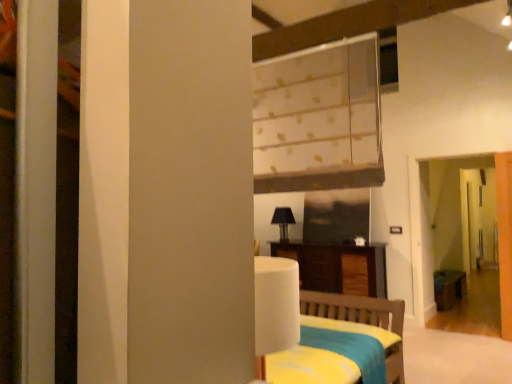
Question: Considering the positions of transparent glass screen door at right and wooden table at right in the image, is transparent glass screen door at right bigger or smaller than wooden table at right?

Choices:
 (A) small
 (B) big

Answer: (B)

Question: From the image's perspective, is transparent glass screen door at right positioned above or below wooden table at right?

Choices:
 (A) below
 (B) above

Answer: (B)

Question: Considering the real-world distances, which object is farthest from the wooden table at right?

Choices:
 (A) transparent glass screen door at right
 (B) white textured blinds at upper center
 (C) dark wood cabinet at center
 (D) black matte table lamp at center
 (E) white glossy door at right

Answer: (B)

Question: Which of these objects is positioned closest to the dark wood cabinet at center?

Choices:
 (A) white textured blinds at upper center
 (B) transparent glass screen door at right
 (C) black matte table lamp at center
 (D) white glossy door at right
 (E) wooden table at right

Answer: (C)